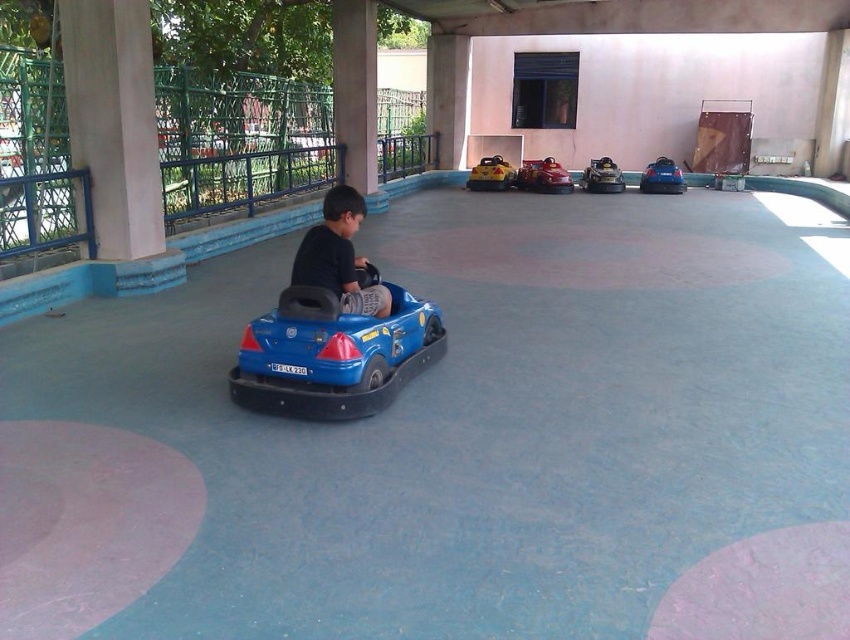
Question: Can you confirm if yellow matte toy car at center is bigger than blue matte bumper car at center?

Choices:
 (A) yes
 (B) no

Answer: (B)

Question: Which object is farther from the camera taking this photo?

Choices:
 (A) blue matte bumper car at center
 (B) matte black car at center
 (C) blue plastic toy car at center

Answer: (A)

Question: Is blue plastic toy car at center positioned before matte black car at center?

Choices:
 (A) yes
 (B) no

Answer: (A)

Question: Which object is farther from the camera taking this photo?

Choices:
 (A) blue plastic toy car at center
 (B) matte black car at center
 (C) shiny red bumper car at center
 (D) metallic silver bumper car at center

Answer: (D)

Question: Is blue plastic toy car at center to the left of matte black car at center from the viewer's perspective?

Choices:
 (A) yes
 (B) no

Answer: (B)

Question: Which of the following is the farthest from the observer?

Choices:
 (A) (604, 161)
 (B) (502, 177)
 (C) (523, 161)

Answer: (C)